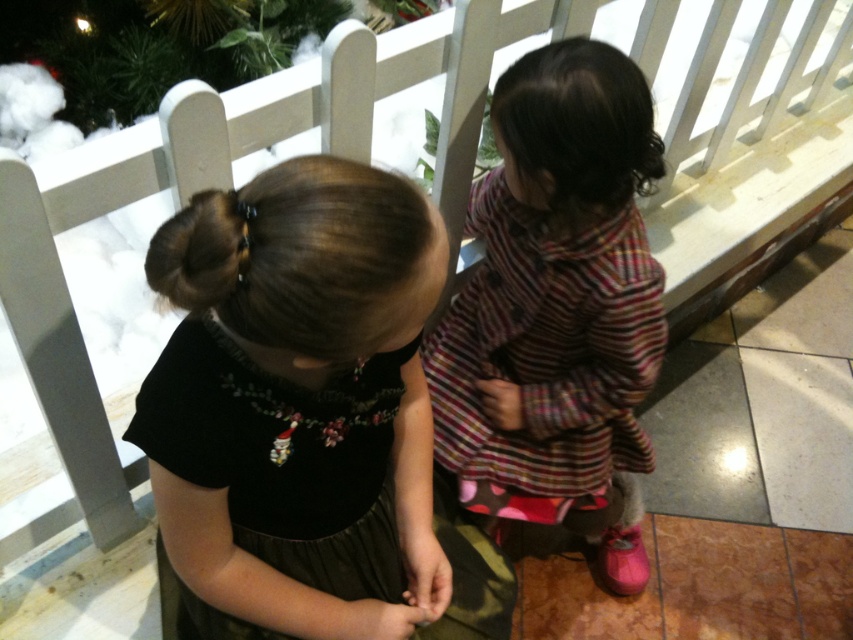
You are a fashion designer observing two dresses in the center of the image. Which dress is taller between the striped fabric dress at center and the black velvet dress at center?

The striped fabric dress at center is taller than the black velvet dress at center according to the description.

You are a photographer trying to position a prop exactly at the center of the image. The striped fabric dress at center is currently located at coordinates 0.481 on the x axis and 0.655 on the y axis. What adjustments should you make to move the prop to the true center of the image?

The striped fabric dress at center is located at coordinates x 0.481 and y 0.655. To move it to the true center of the image, you need to adjust its position so that its coordinates are exactly at the center point, which is typically at x 0.5 and y 0.5. Therefore, move the dress slightly to the left along the x axis from 0.481 to 0.5 and slightly downward along the y axis from 0.655 to 0.5 to reach the true center.

You are a fashion designer observing two dresses displayed in the center of the image. The striped fabric dress at center and the black velvet dress at center. Which dress has a narrower width?

The striped fabric dress at center is thinner than the black velvet dress at center, so the striped fabric dress at center has a narrower width.